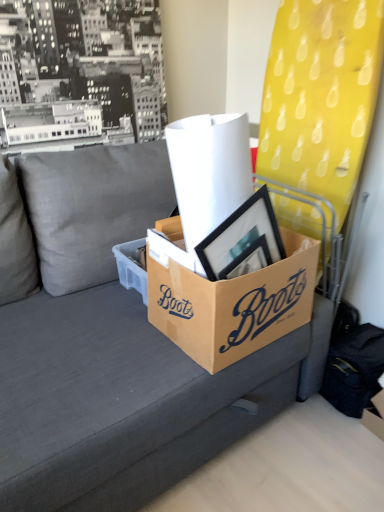
Question: Considering the positions of brown cardboard box at center, the second box when ordered from right to left, and gray fabric couch at center in the image, is brown cardboard box at center, the second box when ordered from right to left, bigger or smaller than gray fabric couch at center?

Choices:
 (A) small
 (B) big

Answer: (A)

Question: Considering the positions of brown cardboard box at center, the second box when ordered from right to left, and gray fabric couch at center in the image, is brown cardboard box at center, the second box when ordered from right to left, taller or shorter than gray fabric couch at center?

Choices:
 (A) tall
 (B) short

Answer: (B)

Question: Which object is the farthest from the brown cardboard box at center, which is counted as the 1th box, starting from the right?

Choices:
 (A) black cardboard box at center
 (B) white paper at center
 (C) gray fabric couch at center
 (D) cardboard box at lower right
 (E) brown cardboard box at center, the second box when ordered from right to left

Answer: (D)

Question: Estimate the real-world distances between objects in this image. Which object is closer to the brown cardboard box at center, the 2th box when ordered from left to right?

Choices:
 (A) brown cardboard box at center, the first box from the left
 (B) gray fabric couch at center
 (C) cardboard box at lower right
 (D) black cardboard box at center
 (E) white paper at center

Answer: (D)